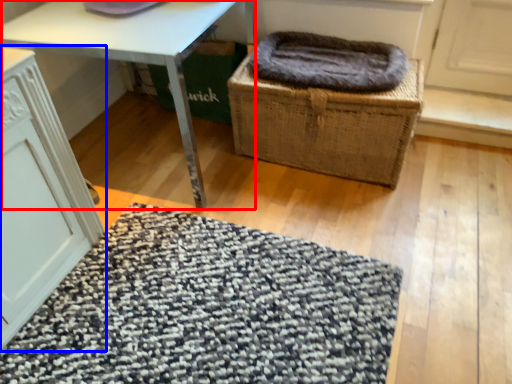
Question: Which point is further to the camera, table (highlighted by a red box) or cabinetry (highlighted by a blue box)?

Choices:
 (A) table
 (B) cabinetry

Answer: (A)